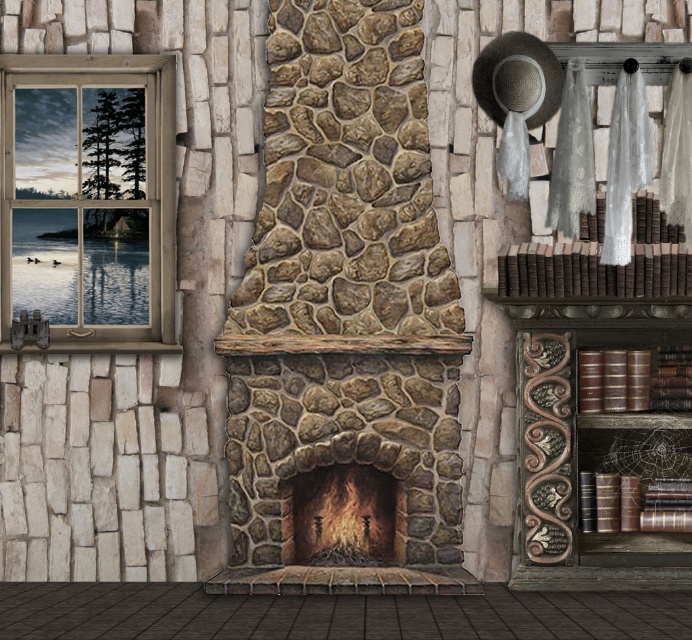
Question: Does wooden frame window at left lie in front of rustic stone fireplace at center?

Choices:
 (A) yes
 (B) no

Answer: (B)

Question: Is wooden frame window at left in front of rustic stone fireplace at center?

Choices:
 (A) no
 (B) yes

Answer: (A)

Question: Which of the following is the closest to the observer?

Choices:
 (A) wooden frame window at left
 (B) rustic stone fireplace at center

Answer: (B)

Question: Is wooden frame window at left thinner than rustic stone fireplace at center?

Choices:
 (A) yes
 (B) no

Answer: (B)

Question: Which point is farther from the camera taking this photo?

Choices:
 (A) (37, 184)
 (B) (336, 513)

Answer: (A)